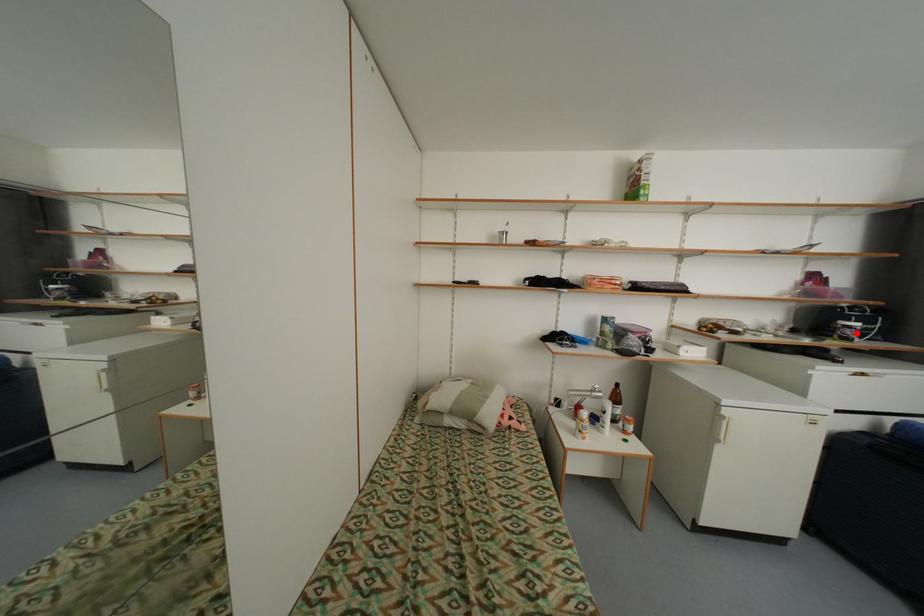
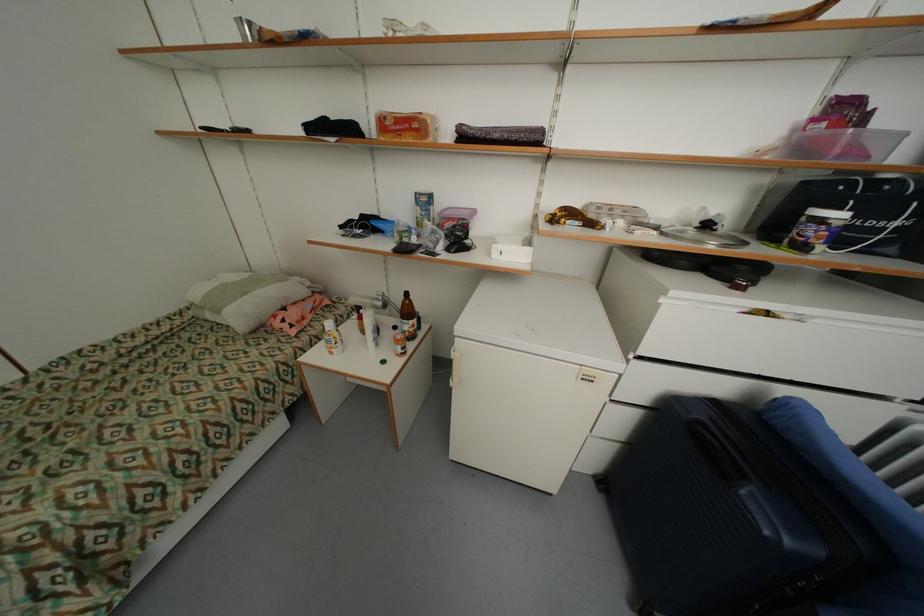
Question: I am providing you with two images of the same scene from different viewpoints. Given a red point in image1, look at the same physical point in image2. Is it:

Choices:
 (A) Closer to the viewpoint
 (B) Farther from the viewpoint

Answer: (B)